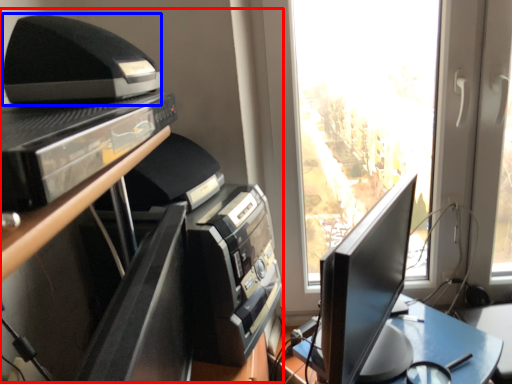
Question: Among these objects, which one is nearest to the camera, entertainment center (highlighted by a red box) or printer (highlighted by a blue box)?

Choices:
 (A) entertainment center
 (B) printer

Answer: (B)